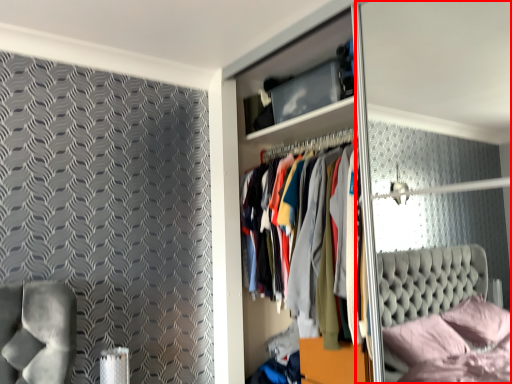
Question: Considering the relative positions of glass door (annotated by the red box) and dresser in the image provided, where is glass door (annotated by the red box) located with respect to the staircase?

Choices:
 (A) right
 (B) left

Answer: (A)